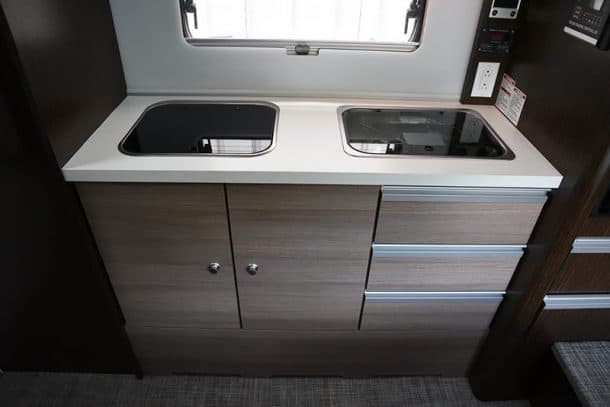
Where is `stove top`? stove top is located at coordinates (417, 145).